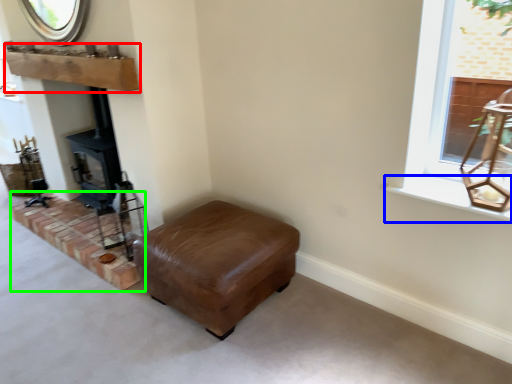
Question: Based on their relative distances, which object is farther from mantle (highlighted by a red box)? Choose from window sill (highlighted by a blue box) and brickwork (highlighted by a green box).

Choices:
 (A) window sill
 (B) brickwork

Answer: (A)